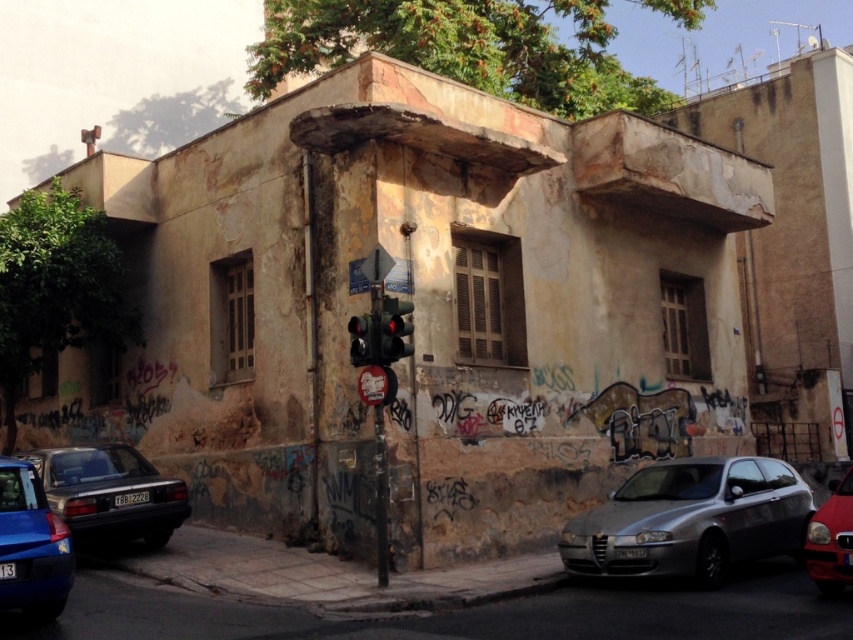
Consider the image. You are a pedestrian standing at the point marked by the coordinates point (691, 518). You want to cross the street to reach the weathered building with two windows and wooden shutters. Is the silver metallic car at center blocking your path?

The point (691, 518) marks the silver metallic car at center, so you are currently standing at the location of the silver metallic car at center. Therefore, you are not blocked by it since you are already there.

You are a pedestrian standing at the intersection and see both the metallic traffic light at center and the black plastic traffic light at center. Which one is located higher up?

The metallic traffic light at center is above the black plastic traffic light at center, so it is located higher up.